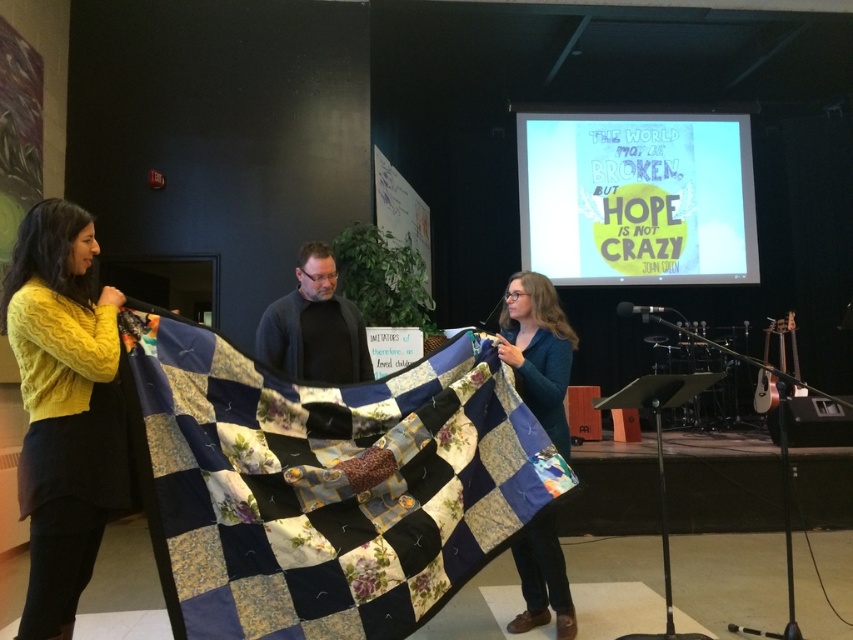
You are organizing a community event and need to choose between the patchwork quilt at center and the blue quilted fabric at center for a display. Based on their sizes, which one would you recommend to cover a large table?

The patchwork quilt at center is larger in size than the blue quilted fabric at center, so it would be better to choose the patchwork quilt at center to cover a large table.

Where is the patchwork quilt at center located in the image?

The patchwork quilt at center is located at point [326,484] in the image.